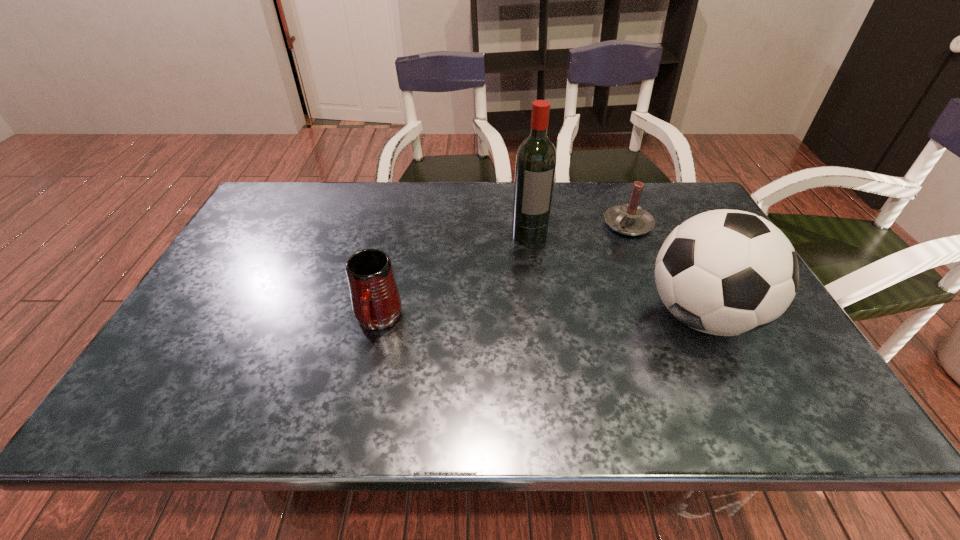
Locate an element on the screen. vacant space located on the label of the second object from left to right is located at coordinates (564, 337).

This screenshot has height=540, width=960. What are the coordinates of `free spot located on the label of the second object from left to right` in the screenshot? It's located at (550, 294).

Image resolution: width=960 pixels, height=540 pixels. Identify the location of object at the far edge. (630, 219).

This screenshot has height=540, width=960. In order to click on object located at the near edge in this screenshot , I will do `click(724, 272)`.

Image resolution: width=960 pixels, height=540 pixels. I want to click on object that is at the right edge, so click(x=724, y=272).

At what (x,y) coordinates should I click in order to perform the action: click on object located in the near right corner section of the desktop. Please return your answer as a coordinate pair (x, y). This screenshot has height=540, width=960. Looking at the image, I should click on (724, 272).

The image size is (960, 540). In order to click on free space at the far edge of the desktop in this screenshot , I will do `click(370, 206)`.

Image resolution: width=960 pixels, height=540 pixels. I want to click on vacant space at the near edge of the desktop, so click(588, 357).

Locate an element on the screen. The height and width of the screenshot is (540, 960). free space at the left edge of the desktop is located at coordinates (217, 312).

The height and width of the screenshot is (540, 960). In order to click on vacant area at the right edge of the desktop in this screenshot , I will do `click(778, 326)`.